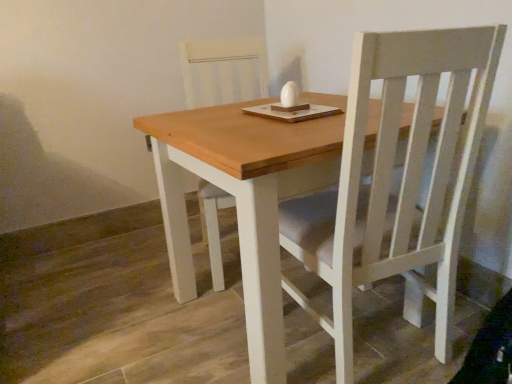
Question: Is wooden table at center smaller than white wood chair at center?

Choices:
 (A) no
 (B) yes

Answer: (A)

Question: Is there a large distance between wooden table at center and white wood chair at center?

Choices:
 (A) yes
 (B) no

Answer: (B)

Question: From a real-world perspective, is wooden table at center on top of white wood chair at center?

Choices:
 (A) yes
 (B) no

Answer: (B)

Question: Considering the relative sizes of wooden table at center and white wood chair at center in the image provided, is wooden table at center thinner than white wood chair at center?

Choices:
 (A) no
 (B) yes

Answer: (A)

Question: Would you say wooden table at center contains white wood chair at center?

Choices:
 (A) yes
 (B) no

Answer: (A)

Question: Is wooden table at center positioned beyond the bounds of white wood chair at center?

Choices:
 (A) no
 (B) yes

Answer: (B)

Question: Are white wood chair at center and wooden table at center far apart?

Choices:
 (A) yes
 (B) no

Answer: (B)

Question: Is white wood chair at center outside wooden table at center?

Choices:
 (A) no
 (B) yes

Answer: (A)

Question: Can you confirm if white wood chair at center is thinner than wooden table at center?

Choices:
 (A) no
 (B) yes

Answer: (B)

Question: Does white wood chair at center contain wooden table at center?

Choices:
 (A) no
 (B) yes

Answer: (A)

Question: Is white wood chair at center smaller than wooden table at center?

Choices:
 (A) yes
 (B) no

Answer: (A)

Question: Does white wood chair at center appear on the right side of wooden table at center?

Choices:
 (A) no
 (B) yes

Answer: (A)

Question: Is white wood chair at center in front of or behind wooden table at center in the image?

Choices:
 (A) behind
 (B) front

Answer: (A)